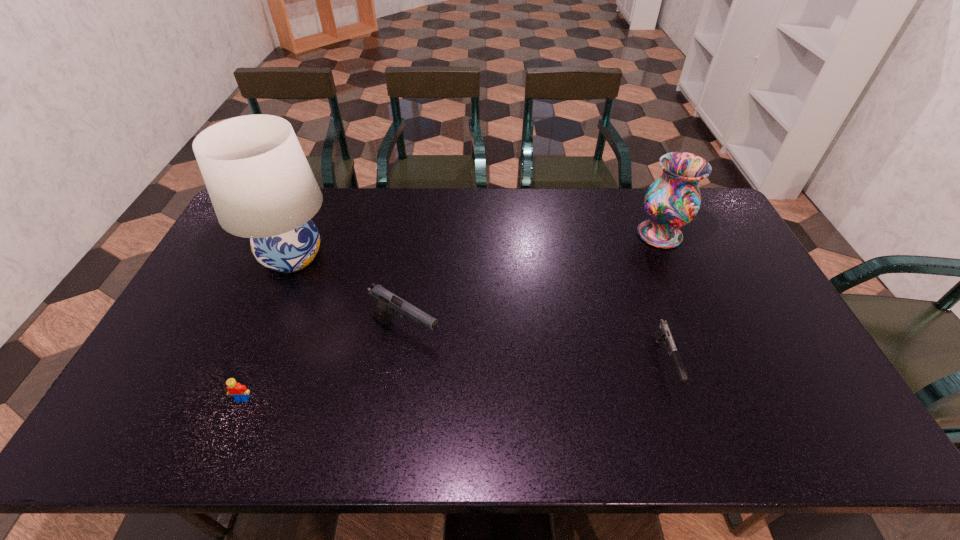
This screenshot has height=540, width=960. Identify the location of vacant position located 0.150m at the muzzle of the third shortest object. (496, 335).

This screenshot has height=540, width=960. Identify the location of vacant area situated 0.090m on the face of the Lego. (227, 438).

Identify the location of blank space located 0.140m at the muzzle end of the shorter gun. The height and width of the screenshot is (540, 960). (696, 451).

At what (x,y) coordinates should I click in order to perform the action: click on lampshade located at the far edge. Please return your answer as a coordinate pair (x, y). Looking at the image, I should click on [x=259, y=181].

You are a GUI agent. You are given a task and a screenshot of the screen. Output one action in this format:
    pyautogui.click(x=<x>, y=<y>)
    Task: Click on the vase present at the far edge
    
    Given the screenshot: What is the action you would take?
    pyautogui.click(x=673, y=200)

The width and height of the screenshot is (960, 540). In order to click on object that is at the left edge in this screenshot , I will do `click(259, 181)`.

The width and height of the screenshot is (960, 540). Identify the location of object that is at the right edge. (673, 200).

The width and height of the screenshot is (960, 540). I want to click on object that is at the far left corner, so click(259, 181).

The image size is (960, 540). I want to click on object at the far right corner, so click(x=673, y=200).

The height and width of the screenshot is (540, 960). In the image, there is a desktop. Find the location of `vacant area at the far edge`. vacant area at the far edge is located at coordinates (526, 198).